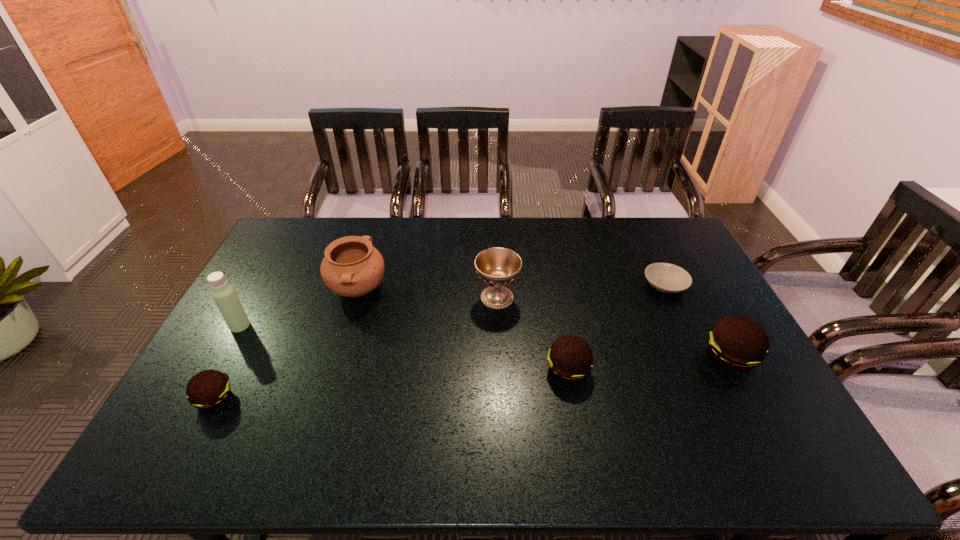
You are a GUI agent. You are given a task and a screenshot of the screen. Output one action in this format:
    pyautogui.click(x=<x>, y=<y>)
    Task: Click on the thermos bottle situated at the left edge
    The width and height of the screenshot is (960, 540).
    Given the screenshot: What is the action you would take?
    pyautogui.click(x=223, y=293)

Where is `patty that is at the right edge`? This screenshot has width=960, height=540. patty that is at the right edge is located at coordinates (736, 343).

This screenshot has height=540, width=960. What are the coordinates of `bowl at the right edge` in the screenshot? It's located at (669, 278).

Where is `object located in the near left corner section of the desktop`? The width and height of the screenshot is (960, 540). object located in the near left corner section of the desktop is located at coordinates (209, 389).

Locate an element on the screen. This screenshot has width=960, height=540. free location at the far edge of the desktop is located at coordinates (571, 231).

Find the location of a particular element. The image size is (960, 540). free region at the near edge of the desktop is located at coordinates (517, 404).

You are a GUI agent. You are given a task and a screenshot of the screen. Output one action in this format:
    pyautogui.click(x=<x>, y=<y>)
    Task: Click on the vacant space at the left edge of the desktop
    The height and width of the screenshot is (540, 960).
    Given the screenshot: What is the action you would take?
    pyautogui.click(x=296, y=255)

This screenshot has width=960, height=540. In order to click on free space at the right edge of the desktop in this screenshot , I will do `click(764, 372)`.

Where is `free space at the near left corner of the desktop`? This screenshot has width=960, height=540. free space at the near left corner of the desktop is located at coordinates (190, 405).

The width and height of the screenshot is (960, 540). I want to click on vacant space that is in between the chalice and the second shortest object, so click(356, 348).